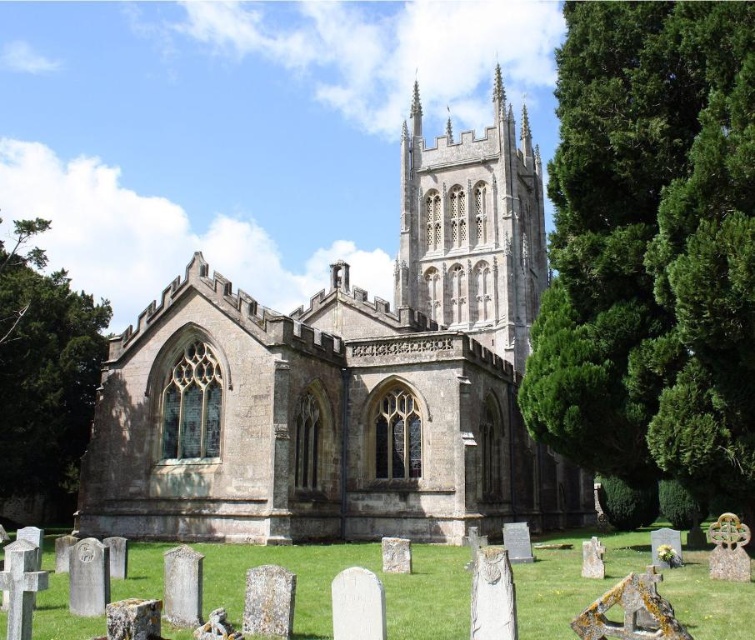
You are standing at the entrance of the historic church and want to take a photo that includes both the stone gothic tower at center and the green leafy tree at left. Given that your camera has a maximum zoom range of 50 meters, will you be able to capture both objects in a single frame without moving closer?

The stone gothic tower at center is 59.58 meters away from the green leafy tree at left. Since the distance between them exceeds the camera maximum zoom range of 50 meters, you will not be able to capture both in a single frame without moving closer.

You are standing in the graveyard looking towards the church. You see the stone gothic tower at center and the green leafy tree at left. Which object is closer to the left side of the scene?

The green leafy tree at left is closer to the left side of the scene because the stone gothic tower at center is positioned on the right side of it.

Consider the image. You are standing at the entrance of the historic church and want to locate two specific points marked on a map. The first point is labeled as point (8, 365), and the second is point (414, 88). Based on the image, which of these two points is closer to the entrance of the church?

Point (8, 365) is closer to the entrance of the church because it is positioned in front of point (414, 88), meaning it is nearer to the viewer who is at the entrance.